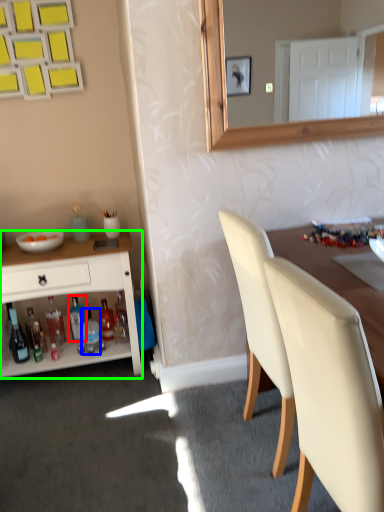
Question: Which is nearer to the bottle (highlighted by a red box)? bottle (highlighted by a blue box) or cabinetry (highlighted by a green box).

Choices:
 (A) bottle
 (B) cabinetry

Answer: (A)